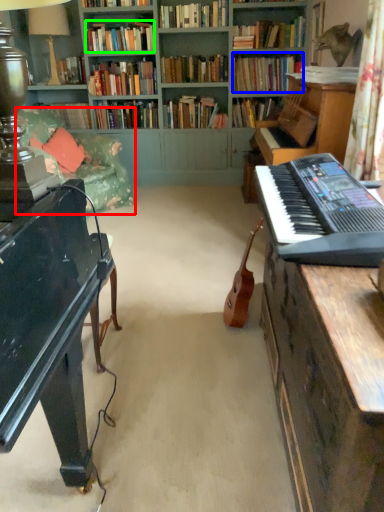
Question: Which object is the closest to the studio couch (highlighted by a red box)? Choose among these: book (highlighted by a blue box) or book (highlighted by a green box).

Choices:
 (A) book
 (B) book

Answer: (B)